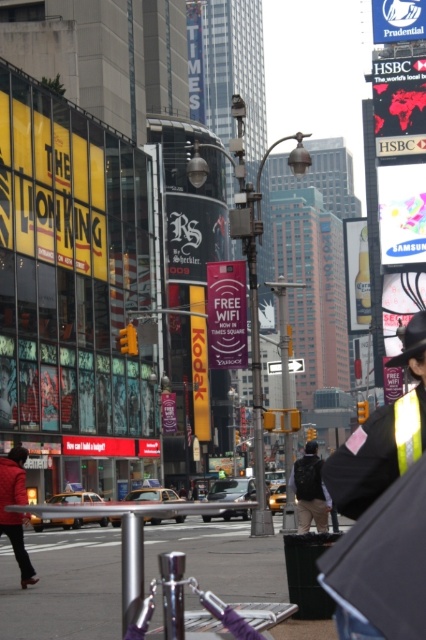
You are a photographer trying to capture both the reflective silver jacket at center and the dark gray backpack at center in the same frame. Which object should you focus on first to ensure both are in the shot?

The reflective silver jacket at center is smaller than the dark gray backpack at center, so you should focus on the reflective silver jacket at center first to ensure both are in the shot.

You are a delivery person with a 1.5 meter wide cart. You need to navigate through the narrow path between the black matte umbrella at lower right and the reflective silver jacket at center. Can your cart fit through this space?

The distance between the black matte umbrella at lower right and the reflective silver jacket at center is 1.83 meters. Since your cart is 1.5 meters wide, it can fit through the space as there is enough width available.